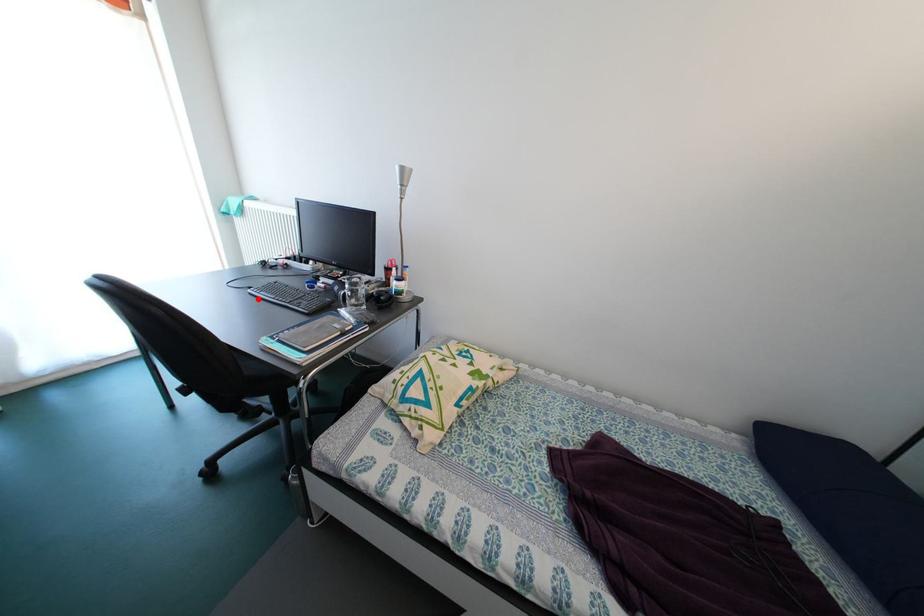
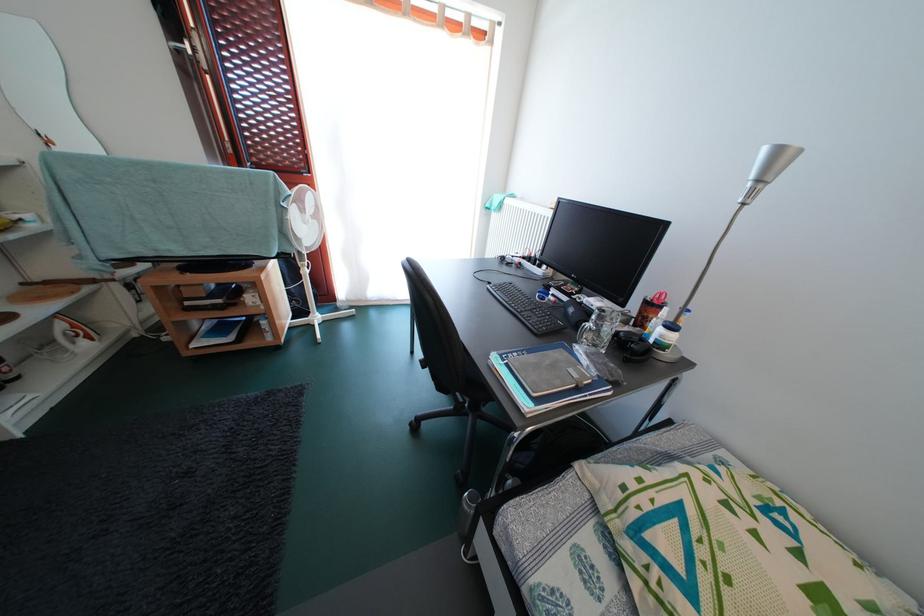
The point at the highlighted location is marked in the first image. Where is the corresponding point in the second image?

(495, 294)